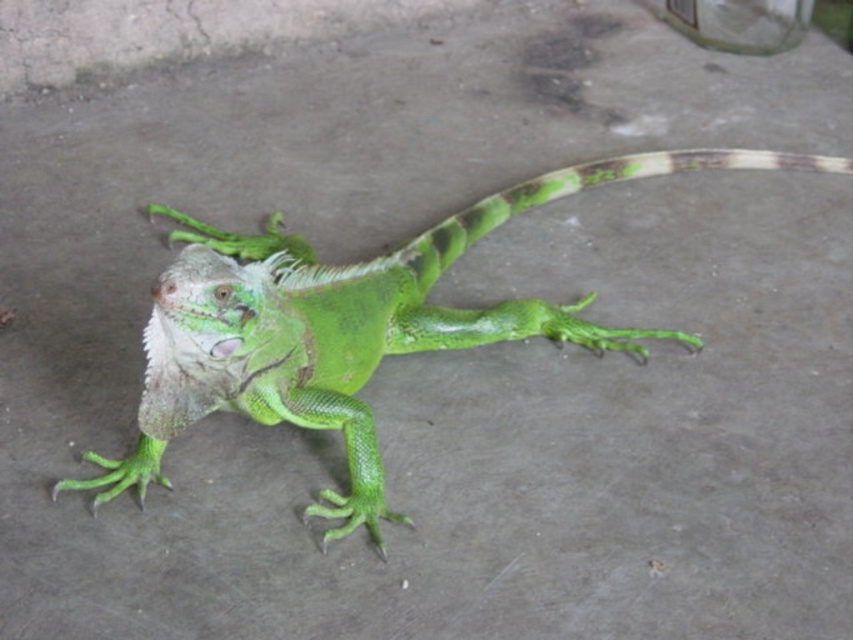
Does green matte lizard at center have a smaller size compared to green scaly tail at center?

Incorrect, green matte lizard at center is not smaller in size than green scaly tail at center.

Who is positioned more to the right, green matte lizard at center or green scaly tail at center?

green scaly tail at center is more to the right.

Which is in front, point (654, 173) or point (512, 205)?

Positioned in front is point (512, 205).

I want to click on green matte lizard at center, so click(347, 324).